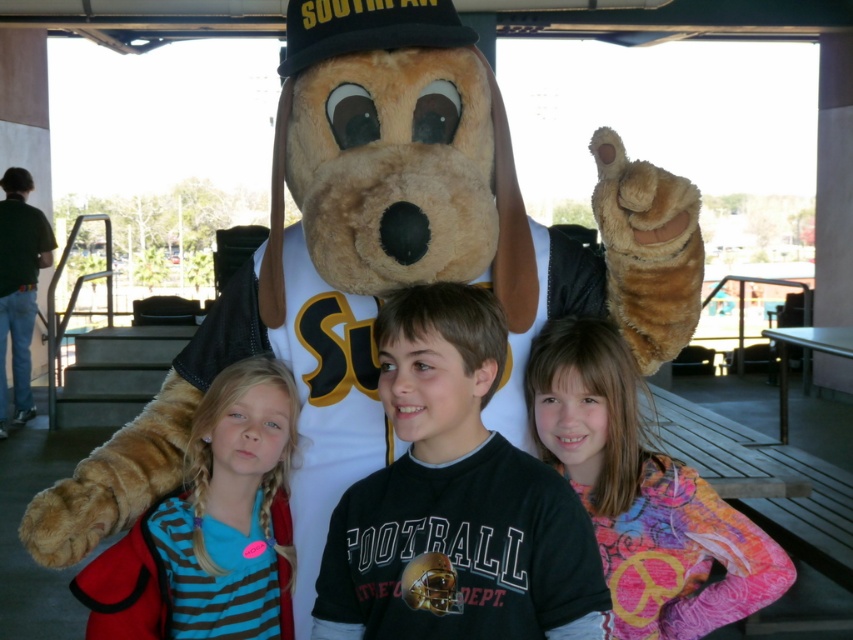
Which is above, black cotton shirt at center or striped fabric shirt at center?

black cotton shirt at center

Who is shorter, black cotton shirt at center or striped fabric shirt at center?

striped fabric shirt at center

Locate an element on the screen. This screenshot has width=853, height=640. black cotton shirt at center is located at coordinates (454, 499).